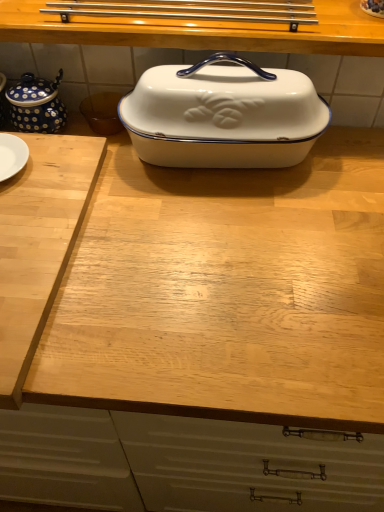
The height and width of the screenshot is (512, 384). What are the coordinates of `free space between light wood cutting board at left and white enamel casserole dish at center` in the screenshot? It's located at (168, 239).